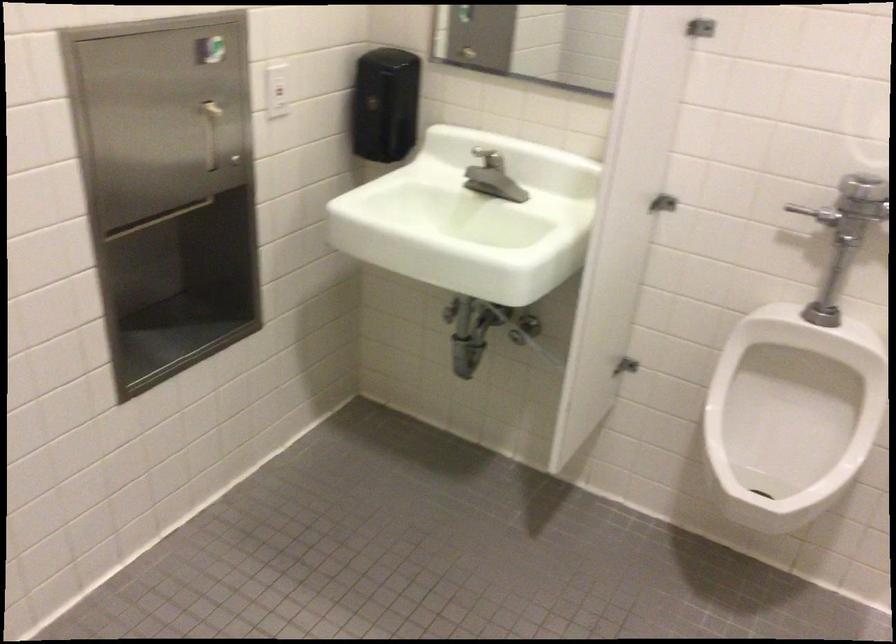
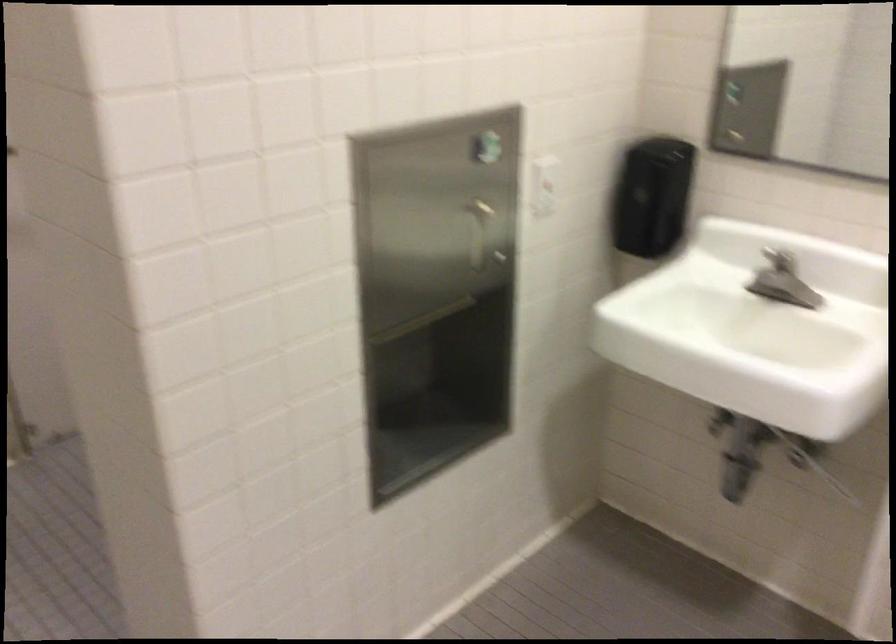
Where in the second image is the point corresponding to (x=274, y=90) from the first image?

(543, 185)